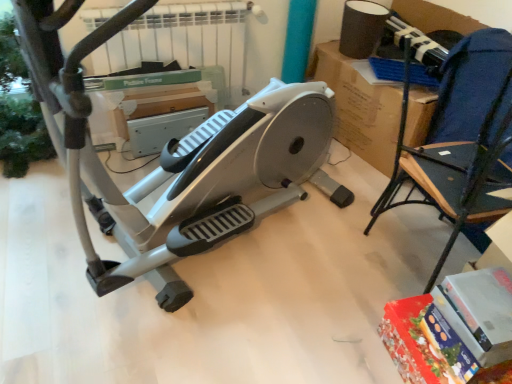
Question: Is silver/grey plastic stationary bicycle at center at the right side of blue fabric chair at right?

Choices:
 (A) yes
 (B) no

Answer: (B)

Question: Does silver/grey plastic stationary bicycle at center have a greater width compared to blue fabric chair at right?

Choices:
 (A) no
 (B) yes

Answer: (B)

Question: From the image's perspective, is silver/grey plastic stationary bicycle at center on top of blue fabric chair at right?

Choices:
 (A) yes
 (B) no

Answer: (A)

Question: Is silver/grey plastic stationary bicycle at center turned away from blue fabric chair at right?

Choices:
 (A) yes
 (B) no

Answer: (B)

Question: Does silver/grey plastic stationary bicycle at center appear on the left side of blue fabric chair at right?

Choices:
 (A) no
 (B) yes

Answer: (B)

Question: From a real-world perspective, is silver/grey plastic stationary bicycle at center positioned over blue fabric chair at right based on gravity?

Choices:
 (A) no
 (B) yes

Answer: (B)

Question: Is blue fabric chair at right positioned with its back to silver/grey plastic stationary bicycle at center?

Choices:
 (A) no
 (B) yes

Answer: (A)

Question: From the image's perspective, does blue fabric chair at right appear lower than silver/grey plastic stationary bicycle at center?

Choices:
 (A) yes
 (B) no

Answer: (A)

Question: Would you say blue fabric chair at right is a long distance from silver/grey plastic stationary bicycle at center?

Choices:
 (A) yes
 (B) no

Answer: (B)

Question: Is blue fabric chair at right closer to the viewer compared to silver/grey plastic stationary bicycle at center?

Choices:
 (A) no
 (B) yes

Answer: (A)

Question: Is blue fabric chair at right thinner than silver/grey plastic stationary bicycle at center?

Choices:
 (A) no
 (B) yes

Answer: (B)

Question: Considering the relative positions of blue fabric chair at right and silver/grey plastic stationary bicycle at center in the image provided, is blue fabric chair at right to the left of silver/grey plastic stationary bicycle at center from the viewer's perspective?

Choices:
 (A) yes
 (B) no

Answer: (B)

Question: From a real-world perspective, relative to silver/grey plastic stationary bicycle at center, is blue fabric chair at right vertically above or below?

Choices:
 (A) below
 (B) above

Answer: (A)